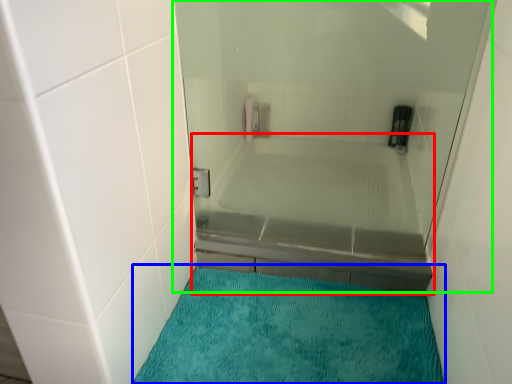
Question: Considering the real-world distances, which object is closest to bathtub (highlighted by a red box)? bath mat (highlighted by a blue box) or shower door (highlighted by a green box).

Choices:
 (A) bath mat
 (B) shower door

Answer: (B)